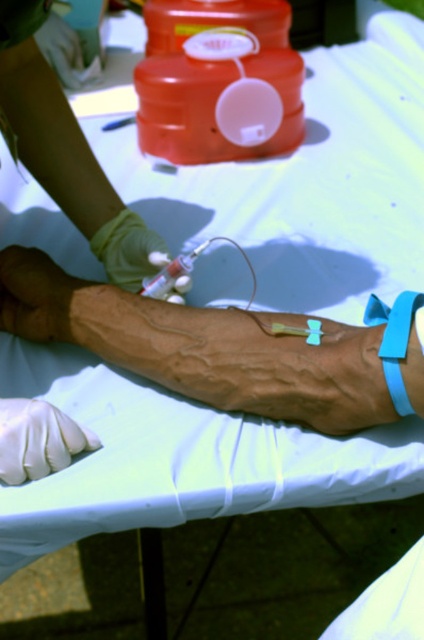
Question: Does green rubber glove at upper left have a greater width compared to translucent plastic syringe at center?

Choices:
 (A) no
 (B) yes

Answer: (B)

Question: Which point is farther to the camera?

Choices:
 (A) (145, 243)
 (B) (190, 268)

Answer: (A)

Question: Is blue rubber band at lower right to the right of translucent plastic syringe at center from the viewer's perspective?

Choices:
 (A) no
 (B) yes

Answer: (B)

Question: Among these objects, which one is nearest to the camera?

Choices:
 (A) brown skin at center
 (B) white latex glove at upper left

Answer: (B)

Question: Which object appears farthest from the camera in this image?

Choices:
 (A) brown skin at center
 (B) blue rubber band at lower right

Answer: (A)

Question: In this image, where is smooth green glove at upper left located relative to green rubber glove at center?

Choices:
 (A) right
 (B) left

Answer: (B)